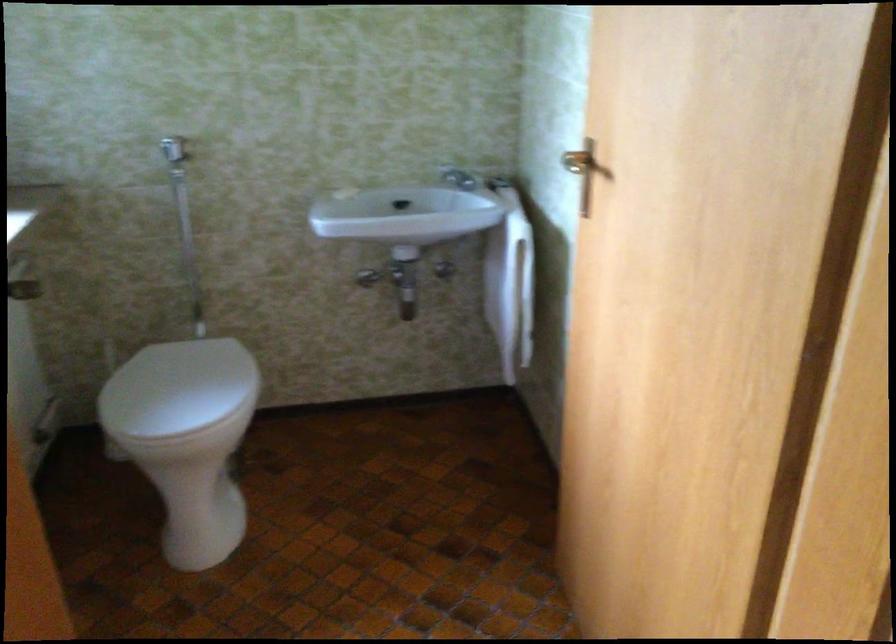
Find the location of a particular element. brass door handle is located at coordinates (575, 162).